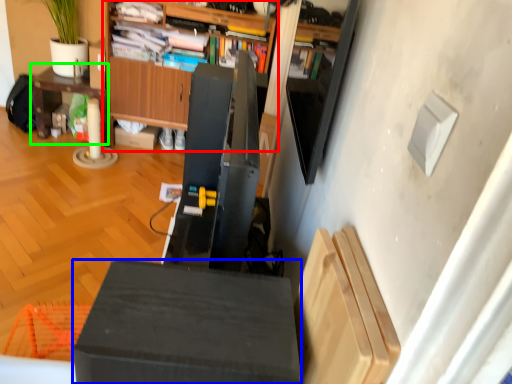
Question: Which is nearer to the cabinetry (highlighted by a red box)? furniture (highlighted by a blue box) or table (highlighted by a green box).

Choices:
 (A) furniture
 (B) table

Answer: (B)